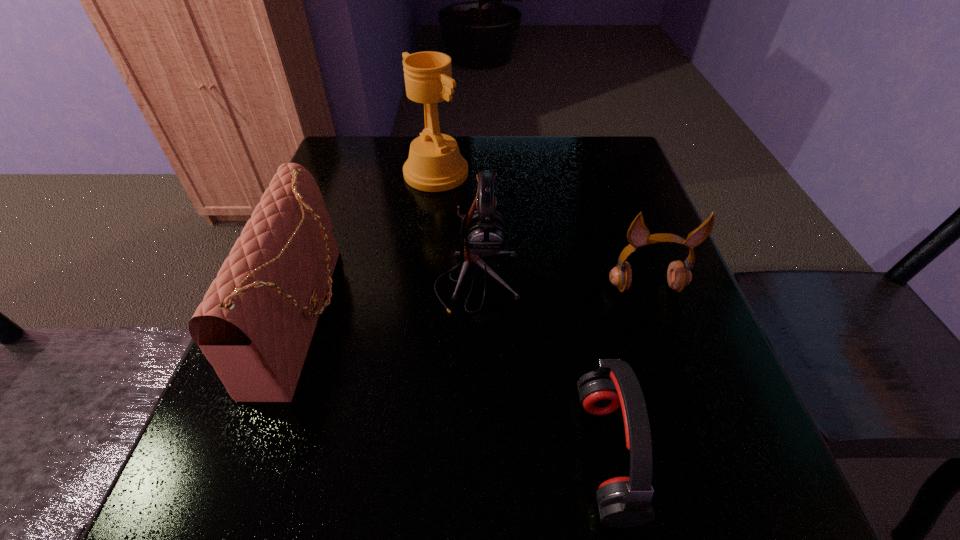
Where is `free space located 0.090m on the front-facing side of the rightmost object`? This screenshot has height=540, width=960. free space located 0.090m on the front-facing side of the rightmost object is located at coordinates (664, 337).

The width and height of the screenshot is (960, 540). In order to click on free location located on the ear cups of the second earphone from left to right in this screenshot , I will do `click(342, 454)`.

This screenshot has width=960, height=540. What are the coordinates of `free location located 0.390m on the ear cups of the second earphone from left to right` in the screenshot? It's located at (x=314, y=454).

You are a GUI agent. You are given a task and a screenshot of the screen. Output one action in this format:
    pyautogui.click(x=<x>, y=<y>)
    Task: Click on the vacant region located 0.270m on the ear cups of the second earphone from left to right
    This screenshot has height=540, width=960.
    Given the screenshot: What is the action you would take?
    pyautogui.click(x=396, y=454)

Identify the location of object situated at the far edge. The height and width of the screenshot is (540, 960). (435, 164).

Where is `object located in the near edge section of the desktop`? object located in the near edge section of the desktop is located at coordinates coord(623,502).

Find the location of `object at the left edge`. object at the left edge is located at coordinates (255, 324).

Where is `object that is positioned at the right edge`? object that is positioned at the right edge is located at coordinates tap(678, 276).

Identify the location of vacant space at the far edge of the desktop. Image resolution: width=960 pixels, height=540 pixels. (479, 163).

In the image, there is a desktop. Where is `vacant area at the left edge`? The width and height of the screenshot is (960, 540). vacant area at the left edge is located at coordinates pos(346,243).